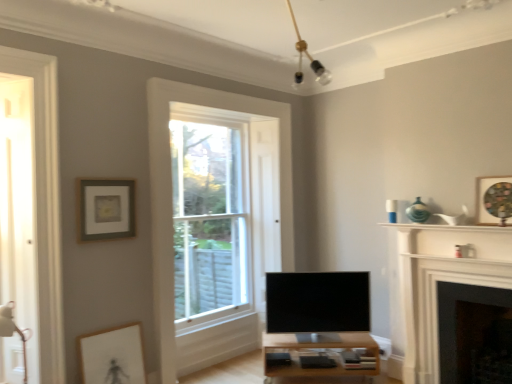
Question: Is silver metallic tv at center looking in the opposite direction of matte white picture frame at lower left, which is the 3th picture frame in top-to-bottom order?

Choices:
 (A) yes
 (B) no

Answer: (B)

Question: Is silver metallic tv at center with matte white picture frame at lower left, the 2th picture frame when ordered from right to left?

Choices:
 (A) yes
 (B) no

Answer: (B)

Question: Considering the relative positions of silver metallic tv at center and matte white picture frame at lower left, which is the 2th picture frame from left to right, in the image provided, is silver metallic tv at center behind matte white picture frame at lower left, which is the 2th picture frame from left to right,?

Choices:
 (A) yes
 (B) no

Answer: (A)

Question: Is silver metallic tv at center shorter than matte white picture frame at lower left, which is the 2th picture frame from left to right?

Choices:
 (A) yes
 (B) no

Answer: (B)

Question: Is silver metallic tv at center wider than matte white picture frame at lower left, which is the 3th picture frame in top-to-bottom order?

Choices:
 (A) yes
 (B) no

Answer: (A)

Question: Is white wood fireplace at right, acting as the first fireplace starting from the left, to the left or to the right of wooden textured picture frame at upper right, which ranks as the 1th picture frame in right-to-left order, in the image?

Choices:
 (A) right
 (B) left

Answer: (B)

Question: Do you think white wood fireplace at right, acting as the first fireplace starting from the left, is within wooden textured picture frame at upper right, which ranks as the 1th picture frame in right-to-left order, or outside of it?

Choices:
 (A) outside
 (B) inside

Answer: (A)

Question: Considering the positions of white wood fireplace at right, the 2th fireplace positioned from the right, and wooden textured picture frame at upper right, the 3th picture frame positioned from the bottom, in the image, is white wood fireplace at right, the 2th fireplace positioned from the right, taller or shorter than wooden textured picture frame at upper right, the 3th picture frame positioned from the bottom,?

Choices:
 (A) tall
 (B) short

Answer: (A)

Question: In terms of width, does white wood fireplace at right, acting as the first fireplace starting from the left, look wider or thinner when compared to wooden textured picture frame at upper right, which ranks as the 3th picture frame in left-to-right order?

Choices:
 (A) wide
 (B) thin

Answer: (A)

Question: Is light wood table at center taller or shorter than matte gray picture frame at upper left, the 2th picture frame positioned from the bottom?

Choices:
 (A) short
 (B) tall

Answer: (A)

Question: Is light wood table at center wider or thinner than matte gray picture frame at upper left, the 2th picture frame positioned from the bottom?

Choices:
 (A) thin
 (B) wide

Answer: (B)

Question: From a real-world perspective, relative to matte gray picture frame at upper left, the first picture frame when ordered from left to right, is light wood table at center vertically above or below?

Choices:
 (A) above
 (B) below

Answer: (B)

Question: In the image, is light wood table at center positioned in front of or behind matte gray picture frame at upper left, arranged as the 2th picture frame when viewed from the top?

Choices:
 (A) behind
 (B) front

Answer: (A)

Question: From their relative heights in the image, would you say clear glass window at center is taller or shorter than light wood table at center?

Choices:
 (A) short
 (B) tall

Answer: (B)

Question: Looking at their shapes, would you say clear glass window at center is wider or thinner than light wood table at center?

Choices:
 (A) thin
 (B) wide

Answer: (A)